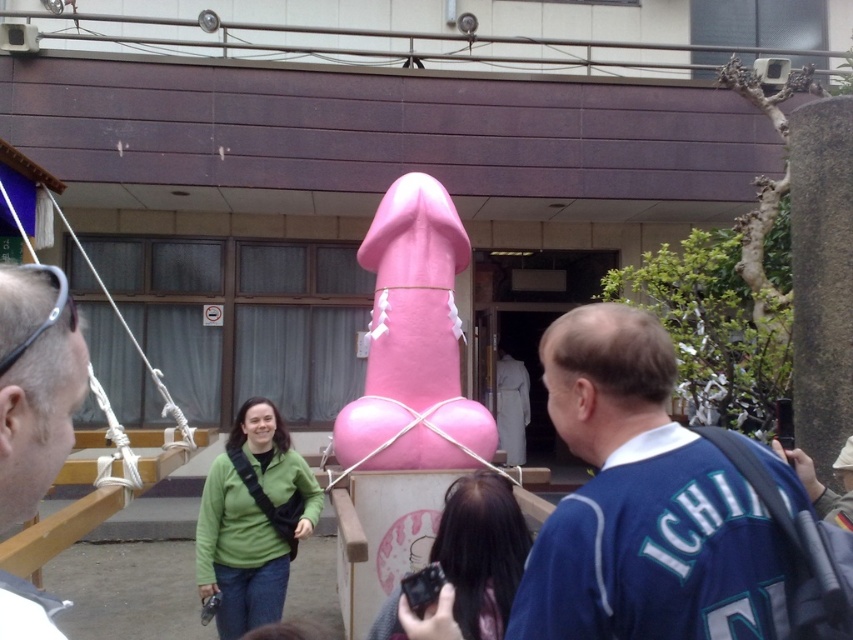
What do you see at coordinates (35, 385) in the screenshot?
I see `matte black sunglasses at left` at bounding box center [35, 385].

Where is `matte black sunglasses at left`? The width and height of the screenshot is (853, 640). matte black sunglasses at left is located at coordinates (35, 385).

The width and height of the screenshot is (853, 640). I want to click on green matte jacket at center, so click(253, 518).

Between green matte jacket at center and green fabric jacket at center, which one has less height?

Standing shorter between the two is green fabric jacket at center.

This screenshot has height=640, width=853. In order to click on green matte jacket at center in this screenshot , I will do `click(253, 518)`.

Does blue jersey at center have a larger size compared to green matte jacket at center?

No.

Does point (695, 490) lie behind point (248, 593)?

That is False.

Locate an element on the screen. The height and width of the screenshot is (640, 853). blue jersey at center is located at coordinates (668, 509).